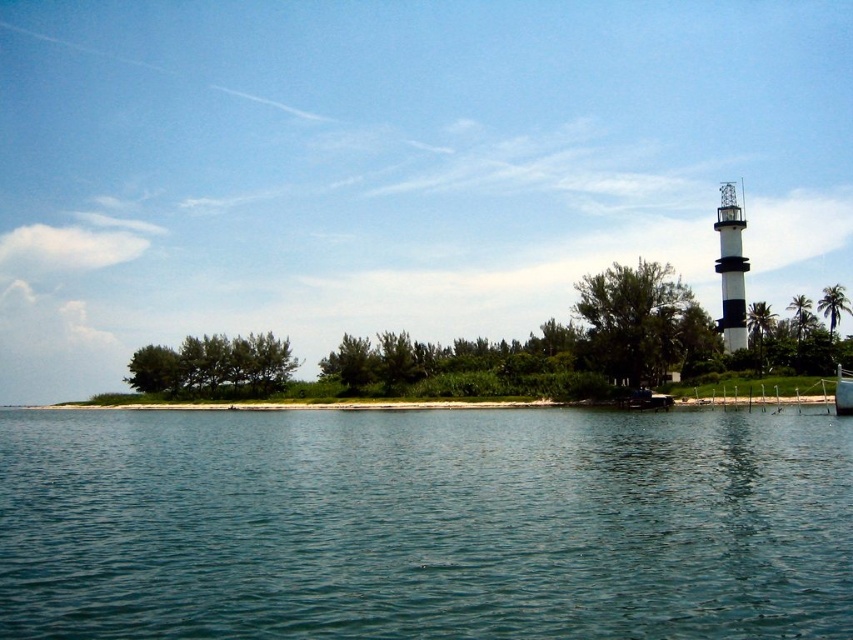
Does green leafy tree at upper right have a larger size compared to black and white striped tower at right?

Correct, green leafy tree at upper right is larger in size than black and white striped tower at right.

Where is `green leafy tree at upper right`? green leafy tree at upper right is located at coordinates (641, 321).

Does point (581, 300) lie behind point (740, 252)?

No, (581, 300) is in front of (740, 252).

This screenshot has height=640, width=853. I want to click on green leafy tree at upper right, so click(641, 321).

Describe the element at coordinates (641, 321) in the screenshot. I see `green leafy tree at upper right` at that location.

Is green leafy tree at upper right wider than green leafy tree at right?

Yes.

Does point (631, 268) come farther from viewer compared to point (796, 321)?

No, (631, 268) is in front of (796, 321).

Where is `green leafy tree at upper right`? green leafy tree at upper right is located at coordinates (641, 321).

Who is higher up, clear blue water at center or green leafy tree at right?

green leafy tree at right

Which of these two, clear blue water at center or green leafy tree at right, stands taller?

green leafy tree at right is taller.

Is point (403, 554) in front of point (802, 332)?

Yes.

Where is `clear blue water at center`? The width and height of the screenshot is (853, 640). clear blue water at center is located at coordinates (424, 524).